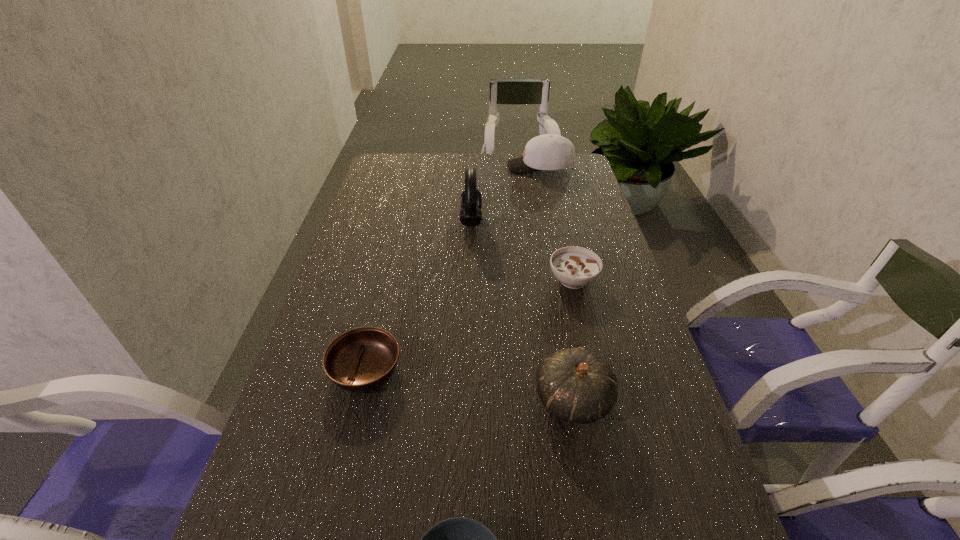
Locate an element on the screen. The height and width of the screenshot is (540, 960). vacant space located on the front-facing side of the baseball cap is located at coordinates (430, 167).

The image size is (960, 540). In order to click on free space located 0.200m on the front-facing side of the baseball cap in this screenshot , I will do `click(456, 167)`.

Find the location of `vacant space located on the back of the gourd`. vacant space located on the back of the gourd is located at coordinates (564, 349).

You are a GUI agent. You are given a task and a screenshot of the screen. Output one action in this format:
    pyautogui.click(x=<x>, y=<y>)
    Task: Click on the blank area located on the left of the farthest soup bowl
    This screenshot has height=540, width=960.
    Given the screenshot: What is the action you would take?
    pyautogui.click(x=454, y=280)

Locate an element on the screen. vacant space located on the back of the leftmost object is located at coordinates (380, 309).

You are a GUI agent. You are given a task and a screenshot of the screen. Output one action in this format:
    pyautogui.click(x=<x>, y=<y>)
    Task: Click on the object situated at the far edge
    
    Given the screenshot: What is the action you would take?
    pyautogui.click(x=548, y=151)

The width and height of the screenshot is (960, 540). What are the coordinates of `object situated at the left edge` in the screenshot? It's located at (362, 359).

Where is `baseball cap present at the right edge`? The image size is (960, 540). baseball cap present at the right edge is located at coordinates (548, 151).

You are a GUI agent. You are given a task and a screenshot of the screen. Output one action in this format:
    pyautogui.click(x=<x>, y=<y>)
    Task: Click on the gourd at the right edge
    The image size is (960, 540).
    Given the screenshot: What is the action you would take?
    pyautogui.click(x=575, y=385)

Find the location of a particular element. soup bowl present at the right edge is located at coordinates (575, 267).